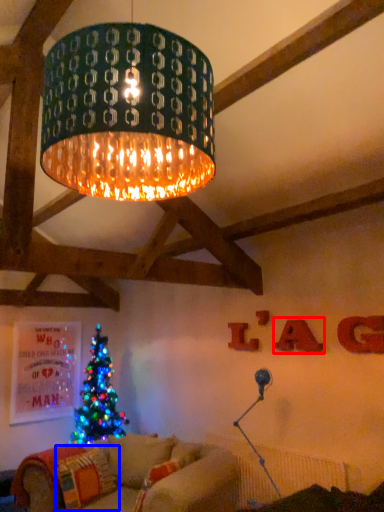
Question: Which point is closer to the camera, letter (highlighted by a red box) or pillow (highlighted by a blue box)?

Choices:
 (A) letter
 (B) pillow

Answer: (B)